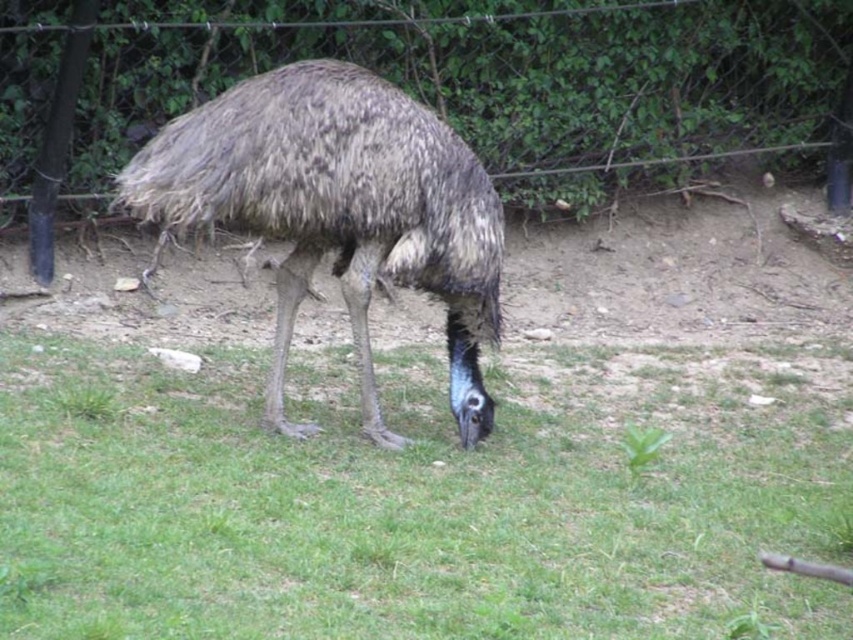
Question: Which object is the farthest from the wire mesh at upper center?

Choices:
 (A) green grass at center
 (B) brown textured ostrich at center

Answer: (A)

Question: Is green grass at center further to camera compared to wire mesh at upper center?

Choices:
 (A) yes
 (B) no

Answer: (B)

Question: Among these objects, which one is nearest to the camera?

Choices:
 (A) green grass at center
 (B) brown textured ostrich at center

Answer: (A)

Question: Is green grass at center behind brown textured ostrich at center?

Choices:
 (A) no
 (B) yes

Answer: (A)

Question: Estimate the real-world distances between objects in this image. Which object is closer to the green grass at center?

Choices:
 (A) wire mesh at upper center
 (B) brown textured ostrich at center

Answer: (B)

Question: Can you confirm if green grass at center is wider than wire mesh at upper center?

Choices:
 (A) no
 (B) yes

Answer: (A)